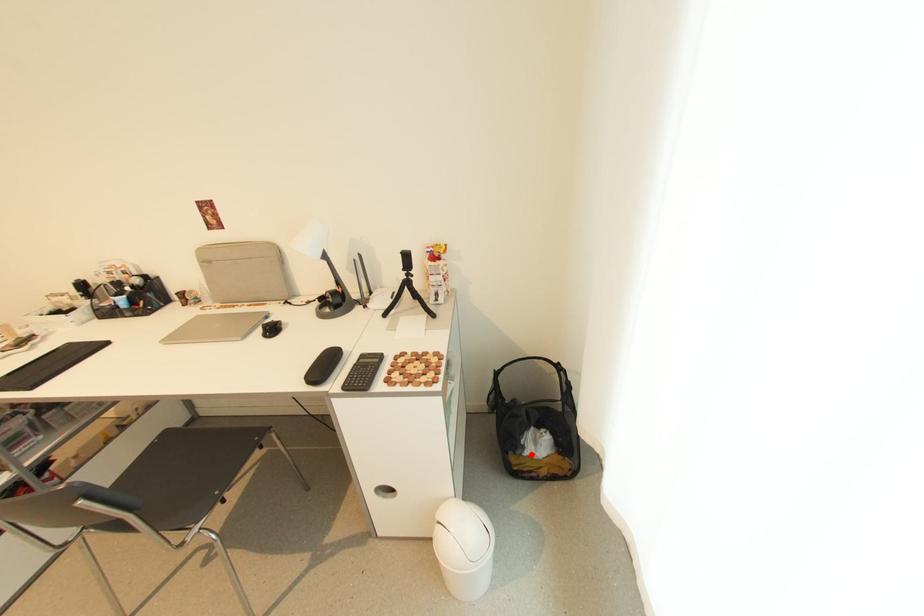
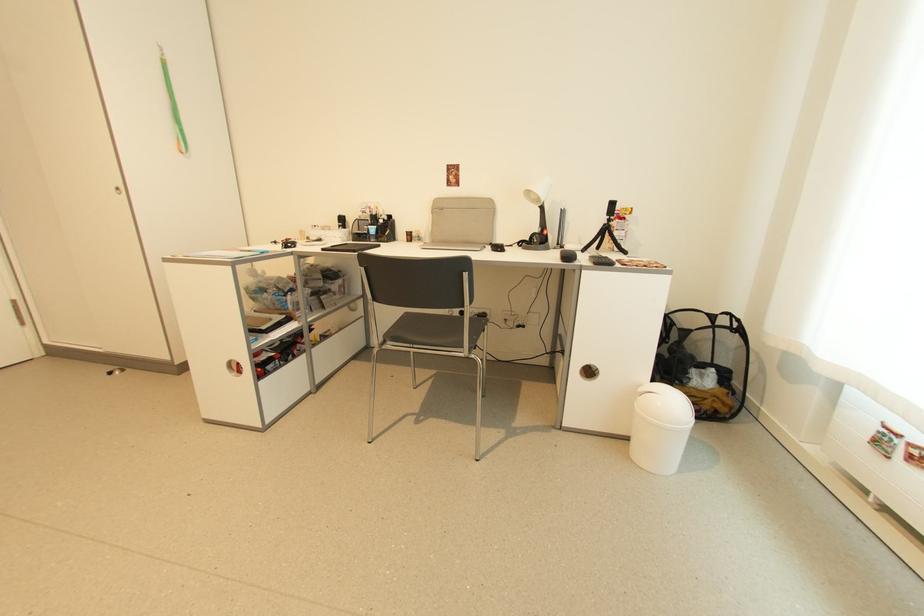
Where in the second image is the point corresponding to the highlighted location from the first image?

(697, 386)